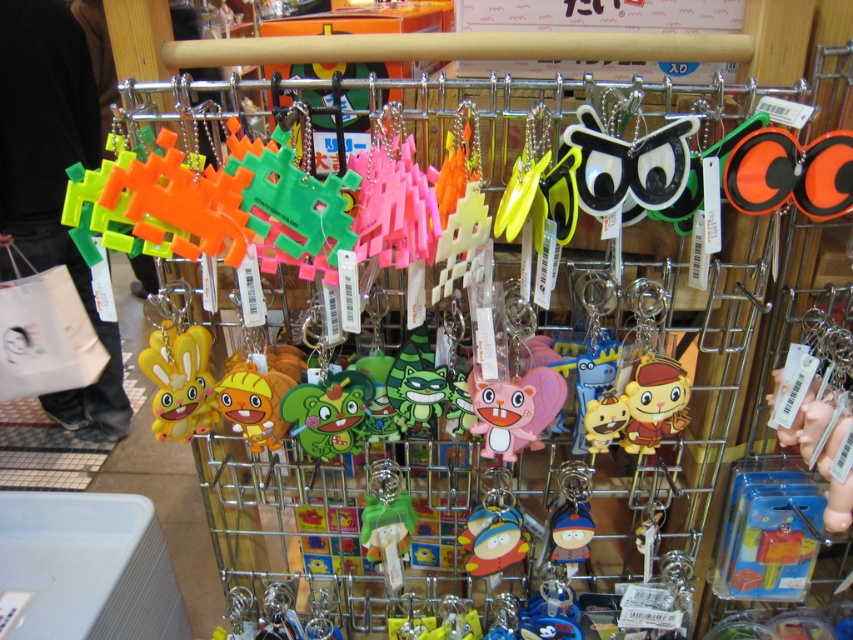
Question: Which of the following is the closest to the observer?

Choices:
 (A) yellow matte rabbit at left
 (B) pink rubber keychain at center

Answer: (A)

Question: Is neon plastic keychains at left further to the viewer compared to yellow matte rabbit at left?

Choices:
 (A) no
 (B) yes

Answer: (B)

Question: Is neon plastic keychains at left to the right of yellow matte rabbit at left from the viewer's perspective?

Choices:
 (A) no
 (B) yes

Answer: (A)

Question: Which of these objects is positioned farthest from the yellow matte rabbit at left?

Choices:
 (A) neon plastic keychains at left
 (B) pink rubber keychain at center

Answer: (A)

Question: Does yellow matte rabbit at left appear over pink rubber keychain at center?

Choices:
 (A) no
 (B) yes

Answer: (B)

Question: Considering the real-world distances, which object is closest to the neon plastic keychains at left?

Choices:
 (A) yellow matte rabbit at left
 (B) pink rubber keychain at center

Answer: (A)